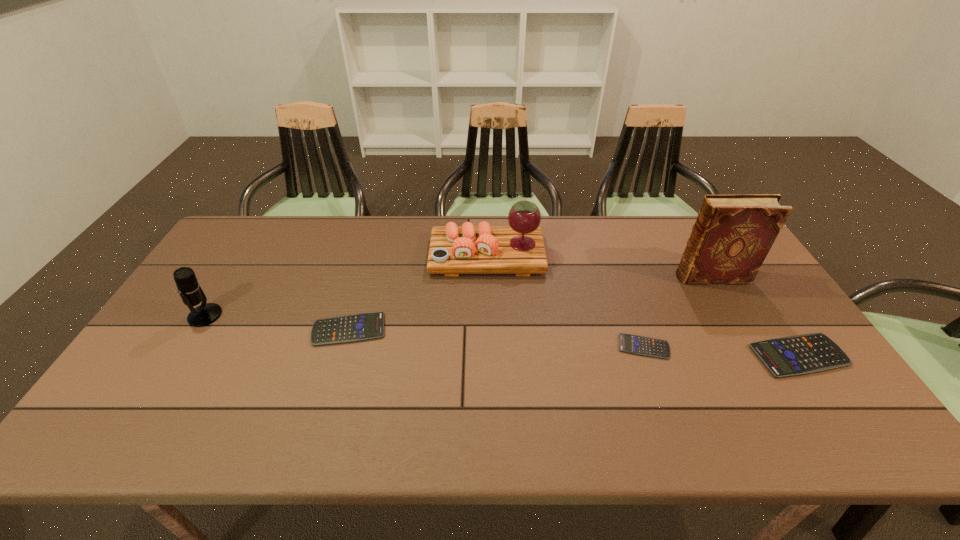
Identify the location of the second shortest object. (358, 327).

I want to click on the leftmost calculator, so click(358, 327).

Image resolution: width=960 pixels, height=540 pixels. Identify the location of the shortest calculator. (634, 344).

You are a GUI agent. You are given a task and a screenshot of the screen. Output one action in this format:
    pyautogui.click(x=<x>, y=<y>)
    Task: Click on the second calculator from right to left
    
    Given the screenshot: What is the action you would take?
    pyautogui.click(x=634, y=344)

Identify the location of the rightmost calculator. (803, 354).

I want to click on platter, so tap(519, 249).

The image size is (960, 540). Identify the location of the leftmost object. (190, 291).

This screenshot has width=960, height=540. I want to click on the tallest object, so click(733, 233).

The width and height of the screenshot is (960, 540). I want to click on free space located 0.260m on the right of the second shortest object, so click(x=481, y=330).

This screenshot has width=960, height=540. I want to click on vacant space located 0.230m on the left of the shortest calculator, so click(x=531, y=347).